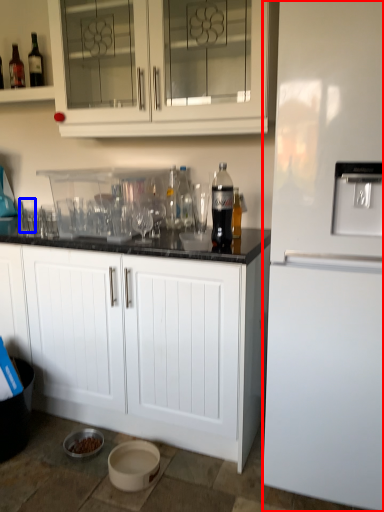
Question: Which object is further to the camera taking this photo, refrigerator (highlighted by a red box) or shot glass (highlighted by a blue box)?

Choices:
 (A) refrigerator
 (B) shot glass

Answer: (B)